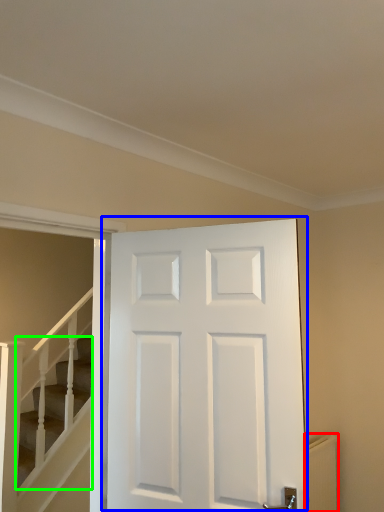
Question: Which object is positioned farthest from radiator (highlighted by a red box)? Select from door (highlighted by a blue box) and stairs (highlighted by a green box).

Choices:
 (A) door
 (B) stairs

Answer: (B)